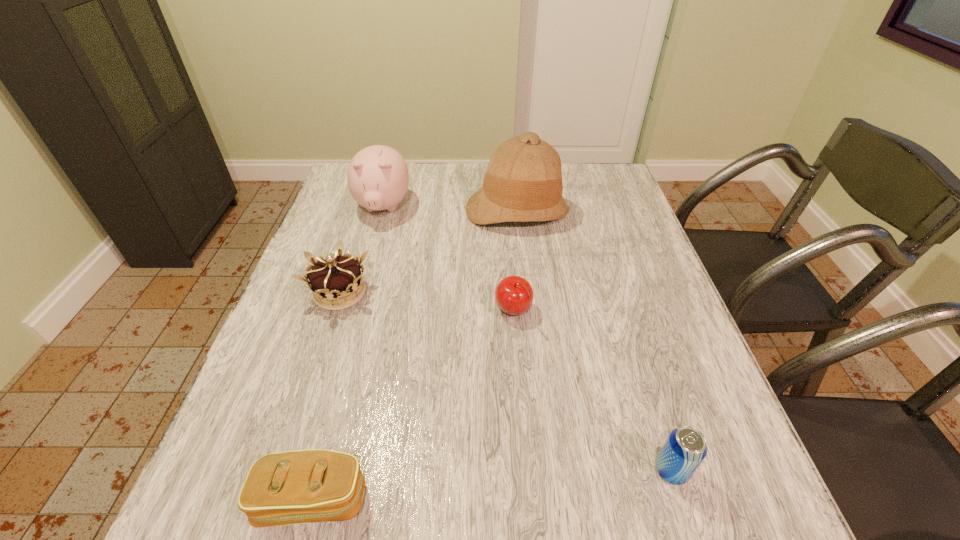
In order to click on the tallest object in this screenshot , I will do `click(523, 183)`.

At what (x,y) coordinates should I click in order to perform the action: click on the fifth shortest object. Please return your answer as a coordinate pair (x, y). This screenshot has height=540, width=960. Looking at the image, I should click on (378, 177).

You are a GUI agent. You are given a task and a screenshot of the screen. Output one action in this format:
    pyautogui.click(x=<x>, y=<y>)
    Task: Click on the crown
    The height and width of the screenshot is (540, 960).
    Given the screenshot: What is the action you would take?
    pyautogui.click(x=336, y=276)

Where is `cherry`? cherry is located at coordinates (514, 295).

You are a GUI agent. You are given a task and a screenshot of the screen. Output one action in this format:
    pyautogui.click(x=<x>, y=<y>)
    Task: Click on the beer can
    This screenshot has width=960, height=540.
    Given the screenshot: What is the action you would take?
    pyautogui.click(x=685, y=448)

You are a GUI agent. You are given a task and a screenshot of the screen. Output one action in this format:
    pyautogui.click(x=<x>, y=<y>)
    Task: Click on the shortest object
    This screenshot has width=960, height=540.
    Given the screenshot: What is the action you would take?
    pyautogui.click(x=292, y=487)

Locate an element on the screen. The image size is (960, 540). vacant area located on the front-facing side of the hat is located at coordinates (524, 275).

At what (x,y) coordinates should I click in order to perform the action: click on vacant space situated at the snout of the piggy bank. Please return your answer as a coordinate pair (x, y). The height and width of the screenshot is (540, 960). Looking at the image, I should click on (372, 244).

I want to click on vacant space located on the right of the crown, so click(534, 292).

In order to click on vacant region located 0.060m on the front of the cherry in this screenshot , I will do `click(516, 349)`.